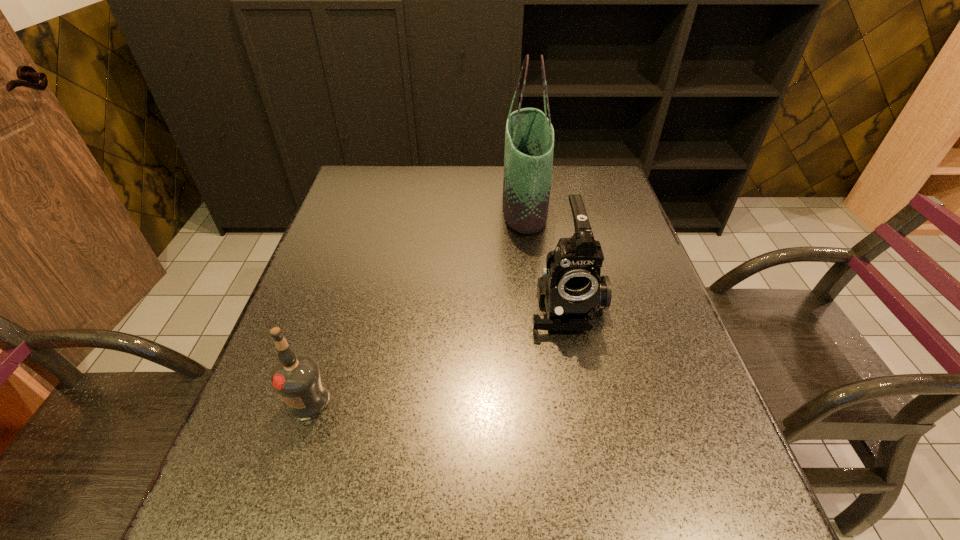
Find the location of a particular element. This screenshot has width=960, height=540. tote bag is located at coordinates (529, 138).

You are a GUI agent. You are given a task and a screenshot of the screen. Output one action in this format:
    pyautogui.click(x=<x>, y=<y>)
    Task: Click on the tallest object
    This screenshot has width=960, height=540.
    Given the screenshot: What is the action you would take?
    pyautogui.click(x=529, y=138)

Identify the location of the second nearest object. The image size is (960, 540). coord(571,288).

Where is `the leftmost object`? This screenshot has width=960, height=540. the leftmost object is located at coordinates (296, 378).

This screenshot has width=960, height=540. Identify the location of vodka. (296, 378).

At what (x,y) coordinates should I click in order to perform the action: click on vacant region located 0.150m on the front of the farthest object. Please return your answer as a coordinate pair (x, y). Looking at the image, I should click on [x=533, y=273].

Identify the location of vacant region located 0.060m on the lens mount of the second nearest object. The image size is (960, 540). (576, 359).

Where is `vacant space located 0.120m on the front label of the leftmost object`? This screenshot has height=540, width=960. vacant space located 0.120m on the front label of the leftmost object is located at coordinates (280, 487).

This screenshot has height=540, width=960. In order to click on object positioned at the far edge in this screenshot , I will do `click(529, 138)`.

You are a GUI agent. You are given a task and a screenshot of the screen. Output one action in this format:
    pyautogui.click(x=<x>, y=<y>)
    Task: Click on the object at the left edge
    This screenshot has width=960, height=540.
    Given the screenshot: What is the action you would take?
    pyautogui.click(x=296, y=378)